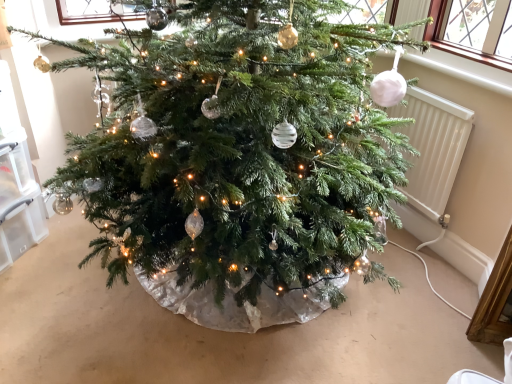
Measure the distance between point (423,208) and camera.

They are 2.13 meters apart.

At what (x,y) coordinates should I click in order to perform the action: click on white ribbed radiator at right. Please return your answer as a coordinate pair (x, y). Image resolution: width=512 pixels, height=384 pixels. Looking at the image, I should click on (433, 148).

Image resolution: width=512 pixels, height=384 pixels. Describe the element at coordinates (433, 148) in the screenshot. I see `white ribbed radiator at right` at that location.

Locate an element on the screen. white ribbed radiator at right is located at coordinates point(433,148).